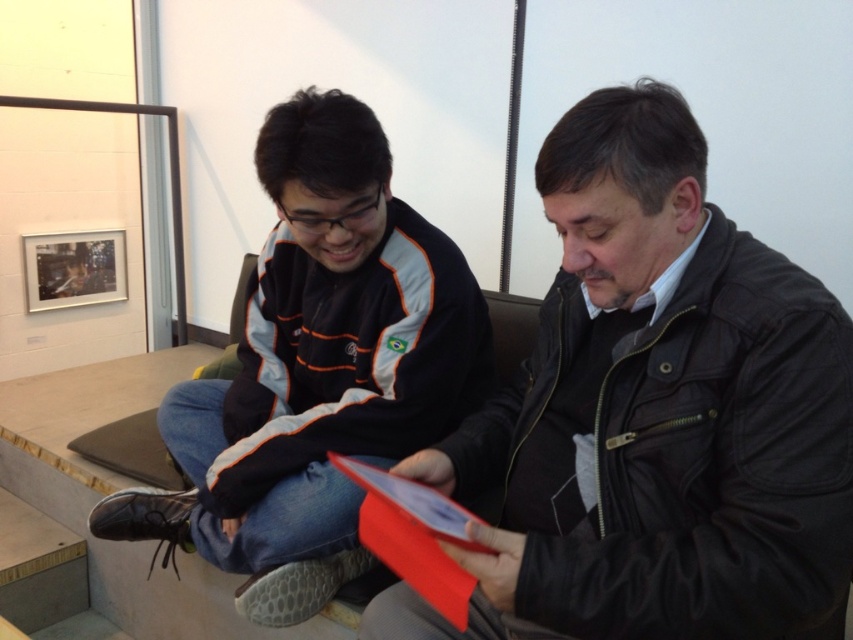
Question: Is the position of leather jacket at center less distant than that of black leather shoe at lower left?

Choices:
 (A) no
 (B) yes

Answer: (B)

Question: In this image, where is leather jacket at center located relative to black leather shoe at lower left?

Choices:
 (A) above
 (B) below

Answer: (A)

Question: Which point is farther to the camera?

Choices:
 (A) leather textured shoe at lower left
 (B) black leather shoe at lower left
 (C) leather jacket at center

Answer: (B)

Question: Estimate the real-world distances between objects in this image. Which object is closer to the leather textured shoe at lower left?

Choices:
 (A) black leather shoe at lower left
 (B) matte black jacket at center
 (C) leather jacket at center

Answer: (B)

Question: Which point is closer to the camera?

Choices:
 (A) (96, 531)
 (B) (331, 340)

Answer: (B)

Question: Does leather jacket at center appear on the left side of black leather shoe at lower left?

Choices:
 (A) no
 (B) yes

Answer: (A)